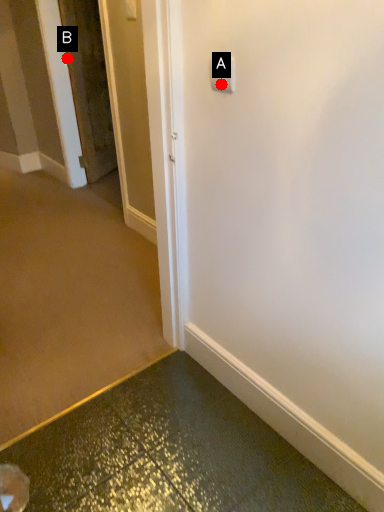
Question: Two points are circled on the image, labeled by A and B beside each circle. Which point appears farthest from the camera in this image?

Choices:
 (A) A is further
 (B) B is further

Answer: (B)